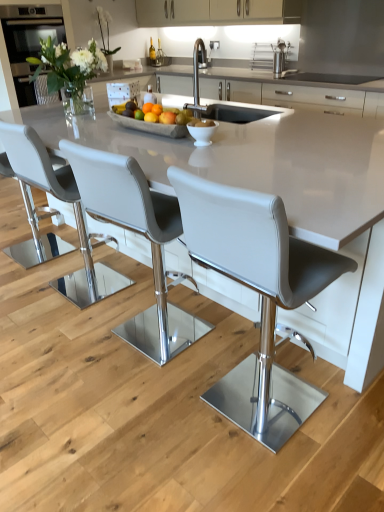
The width and height of the screenshot is (384, 512). Find the location of `free space on the front side of matte gray chair at center, which is the 1th chair in right-to-left order`. free space on the front side of matte gray chair at center, which is the 1th chair in right-to-left order is located at coordinates pos(273,477).